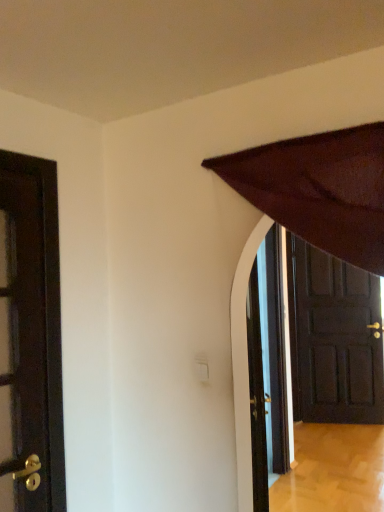
Question: Is dark wood door at right, the 1th door in the right-to-left sequence, at the left side of dark brown wooden door at left, the first door viewed from the front?

Choices:
 (A) yes
 (B) no

Answer: (B)

Question: Is dark brown wooden door at left, the 2th door when ordered from right to left, located within dark wood door at right, the 1th door in the right-to-left sequence?

Choices:
 (A) yes
 (B) no

Answer: (B)

Question: Is dark wood door at right, which is the 2th door in front-to-back order, positioned behind dark brown wooden door at left, the 2th door when ordered from right to left?

Choices:
 (A) yes
 (B) no

Answer: (A)

Question: Can you confirm if dark wood door at right, placed as the second door when sorted from left to right, is thinner than dark brown wooden door at left, which appears as the 1th door when viewed from the left?

Choices:
 (A) no
 (B) yes

Answer: (A)

Question: Considering the relative sizes of dark wood door at right, which is the 1th door from back to front, and dark brown wooden door at left, which appears as the 1th door when viewed from the left, in the image provided, is dark wood door at right, which is the 1th door from back to front, taller than dark brown wooden door at left, which appears as the 1th door when viewed from the left,?

Choices:
 (A) no
 (B) yes

Answer: (B)

Question: Does dark wood door at right, the 1th door in the right-to-left sequence, have a smaller size compared to dark brown wooden door at left, which appears as the 1th door when viewed from the left?

Choices:
 (A) yes
 (B) no

Answer: (B)

Question: Considering the relative sizes of dark brown wooden door at left, which appears as the 1th door when viewed from the left, and dark wood door at right, which is the 1th door from back to front, in the image provided, is dark brown wooden door at left, which appears as the 1th door when viewed from the left, thinner than dark wood door at right, which is the 1th door from back to front,?

Choices:
 (A) yes
 (B) no

Answer: (A)

Question: Does dark brown wooden door at left, the first door viewed from the front, have a lesser height compared to dark wood door at right, placed as the second door when sorted from left to right?

Choices:
 (A) no
 (B) yes

Answer: (B)

Question: Is dark brown wooden door at left, the 2th door when ordered from right to left, positioned beyond the bounds of dark wood door at right, placed as the second door when sorted from left to right?

Choices:
 (A) yes
 (B) no

Answer: (A)

Question: Can you confirm if dark brown wooden door at left, positioned as the second door in back-to-front order, is taller than dark wood door at right, which is the 1th door from back to front?

Choices:
 (A) no
 (B) yes

Answer: (A)

Question: From a real-world perspective, is dark brown wooden door at left, positioned as the second door in back-to-front order, on dark wood door at right, the 1th door in the right-to-left sequence?

Choices:
 (A) yes
 (B) no

Answer: (A)

Question: Does dark brown wooden door at left, positioned as the second door in back-to-front order, have a greater width compared to dark wood door at right, which is the 2th door in front-to-back order?

Choices:
 (A) no
 (B) yes

Answer: (A)

Question: Considering the positions of dark brown wooden door at left, the first door viewed from the front, and dark wood door at right, the 1th door in the right-to-left sequence, in the image, is dark brown wooden door at left, the first door viewed from the front, bigger or smaller than dark wood door at right, the 1th door in the right-to-left sequence,?

Choices:
 (A) small
 (B) big

Answer: (A)